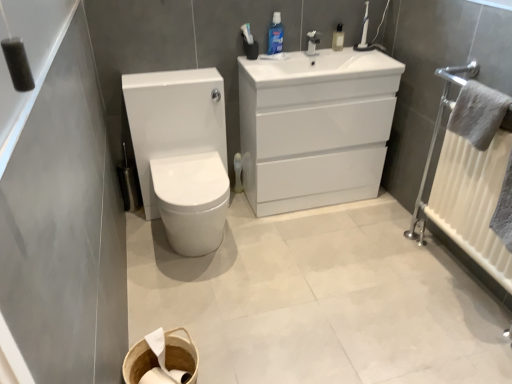
Question: Is the depth of blue glossy mouthwash at upper center, the 2th mouthwash positioned from the right, greater than that of gray fluffy towel at right?

Choices:
 (A) no
 (B) yes

Answer: (B)

Question: Is blue glossy mouthwash at upper center, the 2th mouthwash positioned from the right, facing away from gray fluffy towel at right?

Choices:
 (A) yes
 (B) no

Answer: (B)

Question: Considering the relative sizes of blue glossy mouthwash at upper center, which appears as the first mouthwash when viewed from the left, and gray fluffy towel at right in the image provided, is blue glossy mouthwash at upper center, which appears as the first mouthwash when viewed from the left, taller than gray fluffy towel at right?

Choices:
 (A) yes
 (B) no

Answer: (B)

Question: Can you confirm if blue glossy mouthwash at upper center, which appears as the first mouthwash when viewed from the left, is wider than gray fluffy towel at right?

Choices:
 (A) yes
 (B) no

Answer: (B)

Question: Considering the relative positions of blue glossy mouthwash at upper center, the 2th mouthwash positioned from the right, and gray fluffy towel at right in the image provided, is blue glossy mouthwash at upper center, the 2th mouthwash positioned from the right, to the left of gray fluffy towel at right from the viewer's perspective?

Choices:
 (A) yes
 (B) no

Answer: (A)

Question: From a real-world perspective, is blue glossy mouthwash at upper center, the 2th mouthwash positioned from the right, over gray fluffy towel at right?

Choices:
 (A) no
 (B) yes

Answer: (B)

Question: Is blue glossy mouthwash at upper center, the 2th mouthwash positioned from the right, bigger than white woven basket at lower center?

Choices:
 (A) no
 (B) yes

Answer: (A)

Question: Considering the relative sizes of blue glossy mouthwash at upper center, the 2th mouthwash positioned from the right, and white woven basket at lower center in the image provided, is blue glossy mouthwash at upper center, the 2th mouthwash positioned from the right, taller than white woven basket at lower center?

Choices:
 (A) no
 (B) yes

Answer: (A)

Question: From a real-world perspective, is blue glossy mouthwash at upper center, the 2th mouthwash positioned from the right, on top of white woven basket at lower center?

Choices:
 (A) no
 (B) yes

Answer: (B)

Question: Is blue glossy mouthwash at upper center, which appears as the first mouthwash when viewed from the left, to the right of white woven basket at lower center from the viewer's perspective?

Choices:
 (A) yes
 (B) no

Answer: (A)

Question: From a real-world perspective, is blue glossy mouthwash at upper center, the 2th mouthwash positioned from the right, under white woven basket at lower center?

Choices:
 (A) yes
 (B) no

Answer: (B)

Question: Can we say blue glossy mouthwash at upper center, which appears as the first mouthwash when viewed from the left, lies outside white woven basket at lower center?

Choices:
 (A) yes
 (B) no

Answer: (A)

Question: Considering the relative positions of white glossy sink at upper center and blue glossy mouthwash at upper center, which appears as the first mouthwash when viewed from the left, in the image provided, is white glossy sink at upper center in front of blue glossy mouthwash at upper center, which appears as the first mouthwash when viewed from the left,?

Choices:
 (A) no
 (B) yes

Answer: (B)